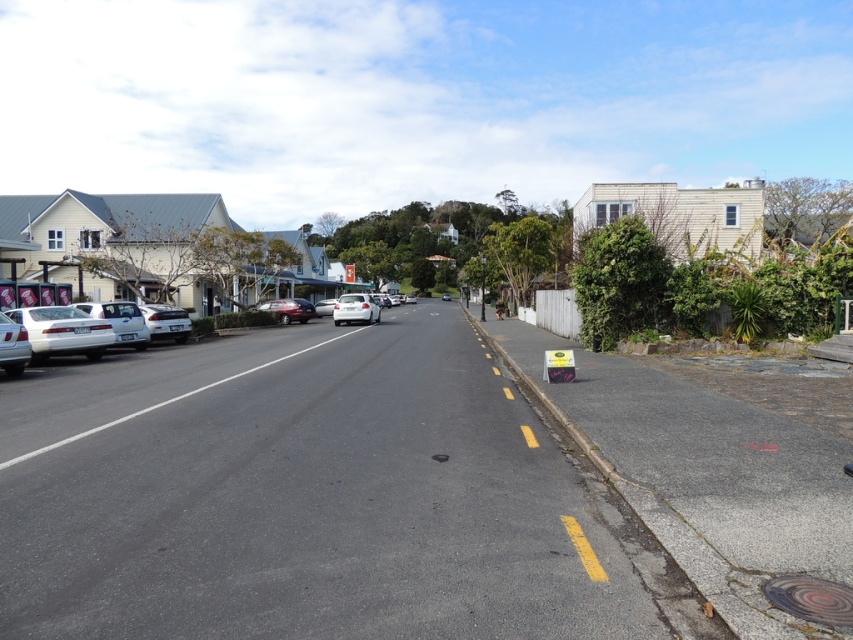
Can you confirm if silver metallic car at left is thinner than white glossy sedan at center?

Yes.

Is silver metallic car at left closer to camera compared to white glossy sedan at center?

That is True.

Locate an element on the screen. This screenshot has width=853, height=640. silver metallic car at left is located at coordinates (12, 346).

Is point (62, 330) more distant than point (115, 305)?

No, (62, 330) is closer to viewer.

Consider the image. Who is shorter, white glossy sedan at left or white matte car at left?

white matte car at left

The height and width of the screenshot is (640, 853). In order to click on white glossy sedan at left in this screenshot , I will do `click(62, 332)`.

Looking at this image, does white matte car at left appear over white glossy sedan at center?

Incorrect, white matte car at left is not positioned above white glossy sedan at center.

Is white matte car at left to the left of white glossy sedan at center from the viewer's perspective?

In fact, white matte car at left is to the right of white glossy sedan at center.

Describe the element at coordinates (120, 321) in the screenshot. I see `white matte car at left` at that location.

I want to click on white matte car at left, so click(120, 321).